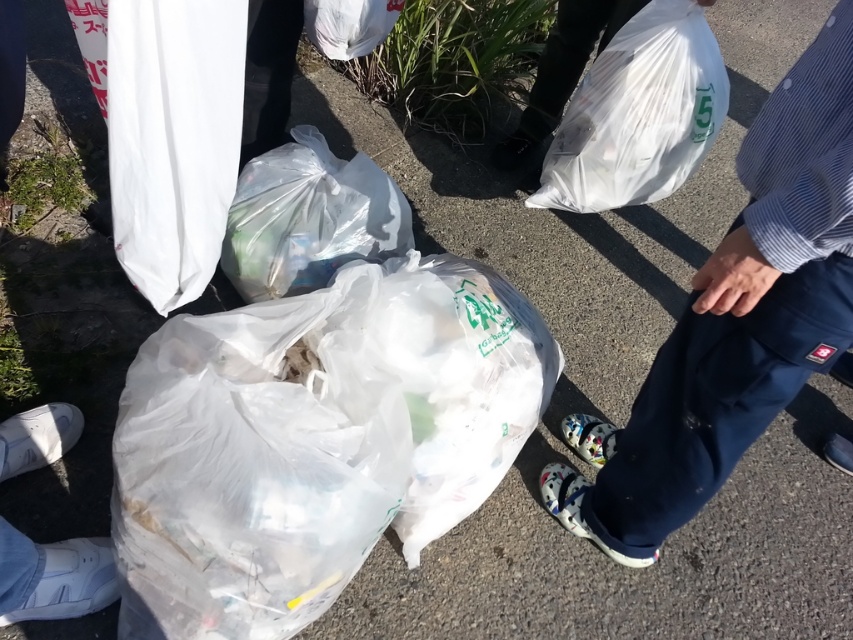
Question: Where is translucent plastic bag at center located in relation to white matte sneakers at lower left in the image?

Choices:
 (A) below
 (B) above

Answer: (B)

Question: Which point appears closest to the camera in this image?

Choices:
 (A) (672, 182)
 (B) (271, 218)
 (C) (30, 547)

Answer: (C)

Question: Which object is closer to the camera taking this photo?

Choices:
 (A) transparent plastic bag at upper right
 (B) translucent plastic bag at center
 (C) transparent plastic bag at center
 (D) white matte sneakers at lower left

Answer: (C)

Question: Among these points, which one is nearest to the camera?

Choices:
 (A) (55, 403)
 (B) (248, 268)
 (C) (489, 346)

Answer: (C)

Question: Can you confirm if transparent plastic bag at center is positioned below translucent plastic bag at center?

Choices:
 (A) no
 (B) yes

Answer: (B)

Question: Can you confirm if transparent plastic bag at center is smaller than blue cotton pants at lower right?

Choices:
 (A) yes
 (B) no

Answer: (A)